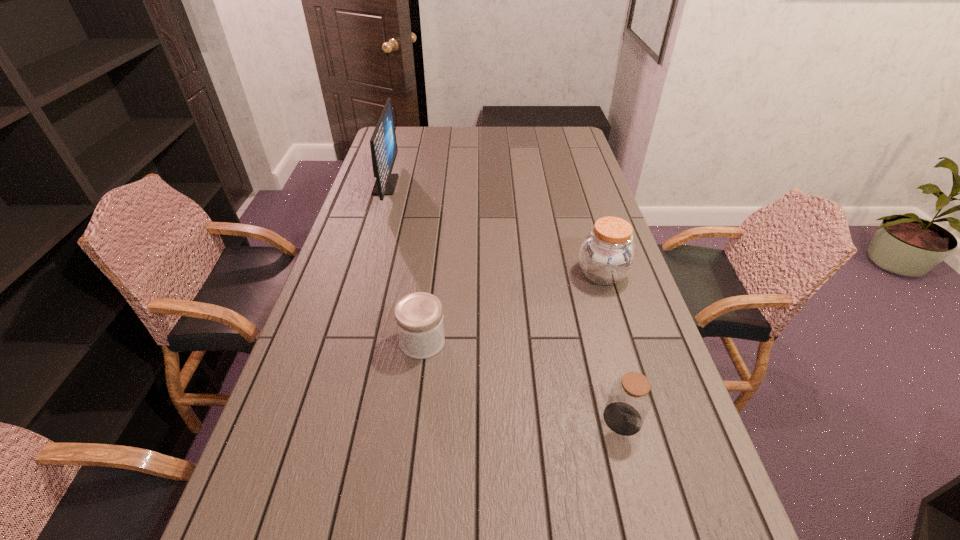
Find the location of a particular element. The width and height of the screenshot is (960, 540). vacant space that satisfies the following two spatial constraints: 1. on the screen side of the leftmost object; 2. on the left side of the second farthest jar is located at coordinates (338, 342).

The width and height of the screenshot is (960, 540). Identify the location of vacant space that satisfies the following two spatial constraints: 1. on the screen side of the farthest object; 2. on the back side of the second farthest object. (358, 274).

Find the location of `vacant region that satisfies the following two spatial constraints: 1. on the screen side of the tallest object; 2. on the right side of the farthest jar`. vacant region that satisfies the following two spatial constraints: 1. on the screen side of the tallest object; 2. on the right side of the farthest jar is located at coordinates (358, 274).